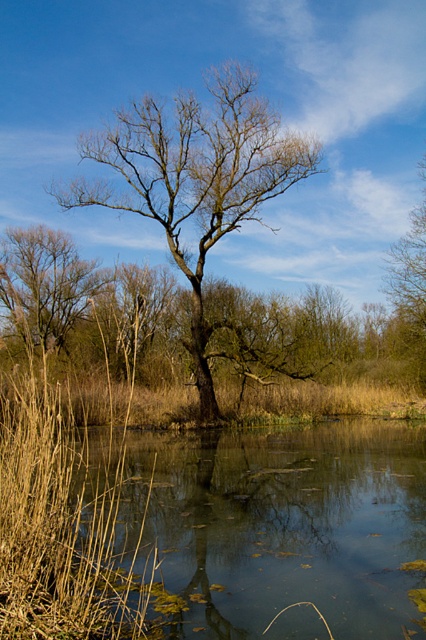
You are a photographer trying to capture the brown grass at left and the bare wood tree at center in the same frame. Based on their positions, which object will appear closer to the camera in the photo?

The brown grass at left appears closer to the camera because it is positioned in front of the bare wood tree at center.

You are an artist sketching the scene from the image. You want to place the bare wood tree at center in the exact middle of your drawing. Based on the scene description, will the tree be positioned correctly if you draw it at the coordinates given in the description?

The 2D location of the bare wood tree at center is at point (195, 179), which is not the exact middle of the drawing. The exact middle would be at coordinates (213, 320). Therefore, the tree will not be positioned correctly if placed at the given coordinates.